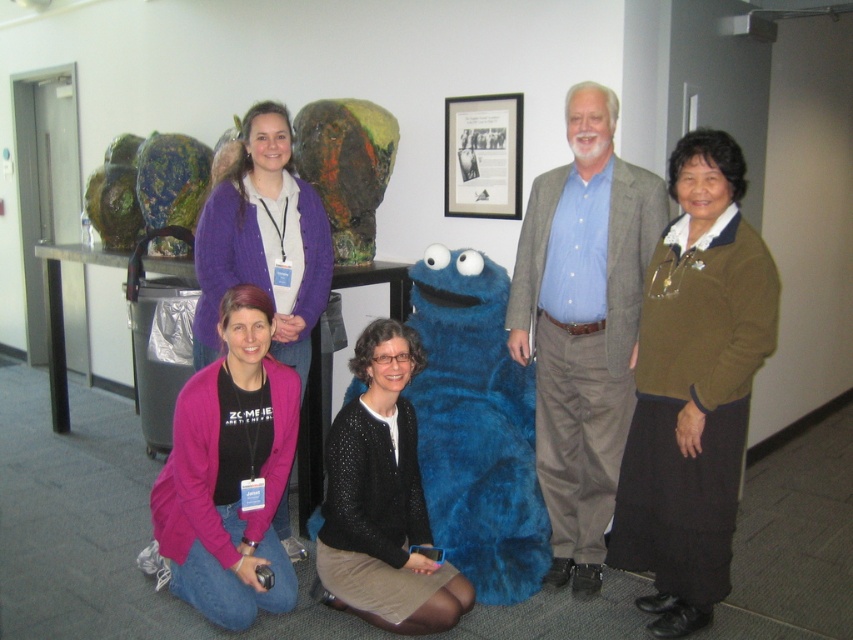
Is green sweater at right closer to the viewer compared to pink fleece jacket at lower left?

Yes, green sweater at right is in front of pink fleece jacket at lower left.

Is point (770, 330) less distant than point (242, 342)?

Yes, point (770, 330) is closer to viewer.

Identify the location of green sweater at right. (693, 388).

Is black knitted sweater at center below purple sweater at upper left?

Yes, black knitted sweater at center is below purple sweater at upper left.

Can you confirm if black knitted sweater at center is smaller than purple sweater at upper left?

Correct, black knitted sweater at center occupies less space than purple sweater at upper left.

Who is more forward, (352, 497) or (253, 252)?

Point (352, 497) is more forward.

Identify the location of black knitted sweater at center. The height and width of the screenshot is (640, 853). (383, 499).

Between green sweater at right and black knitted sweater at center, which one appears on the left side from the viewer's perspective?

black knitted sweater at center

Between green sweater at right and black knitted sweater at center, which one is positioned lower?

black knitted sweater at center is lower down.

Find the location of a particular element. This screenshot has height=640, width=853. green sweater at right is located at coordinates (693, 388).

The width and height of the screenshot is (853, 640). In order to click on green sweater at right in this screenshot , I will do `click(693, 388)`.